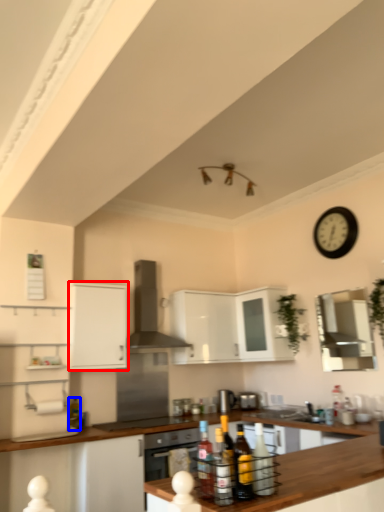
Question: Which object is closer to the camera taking this photo, cabinetry (highlighted by a red box) or bottle (highlighted by a blue box)?

Choices:
 (A) cabinetry
 (B) bottle

Answer: (A)